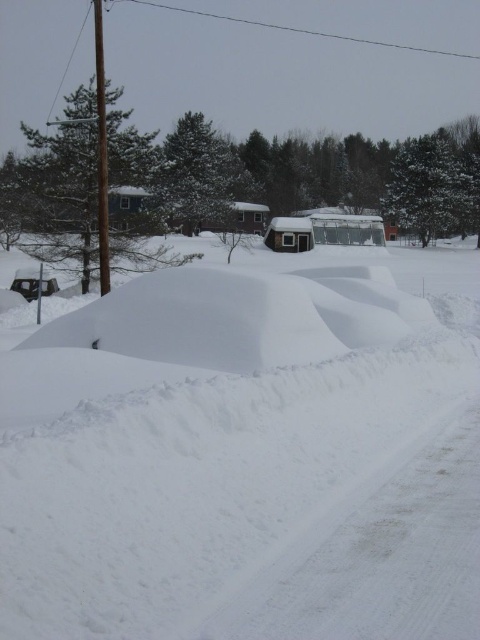
Who is positioned more to the right, white fluffy snow at center or shiny black car at left?

Positioned to the right is white fluffy snow at center.

Describe the element at coordinates (229, 444) in the screenshot. I see `white fluffy snow at center` at that location.

Which is behind, point (419, 353) or point (12, 282)?

Point (12, 282)

You are a GUI agent. You are given a task and a screenshot of the screen. Output one action in this format:
    pyautogui.click(x=<x>, y=<y>)
    Task: Click on the white fluffy snow at center
    The image size is (480, 640).
    Given the screenshot: What is the action you would take?
    pyautogui.click(x=229, y=444)